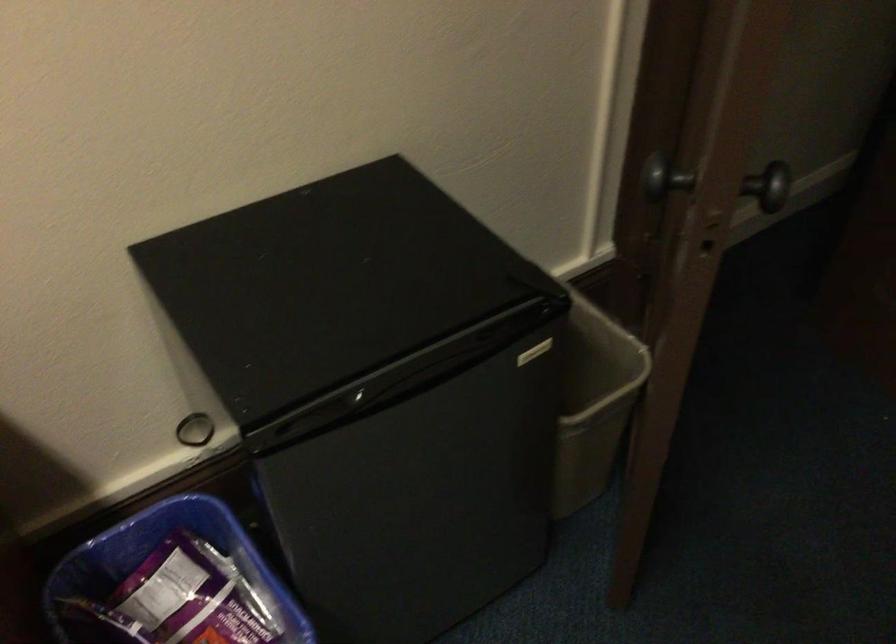
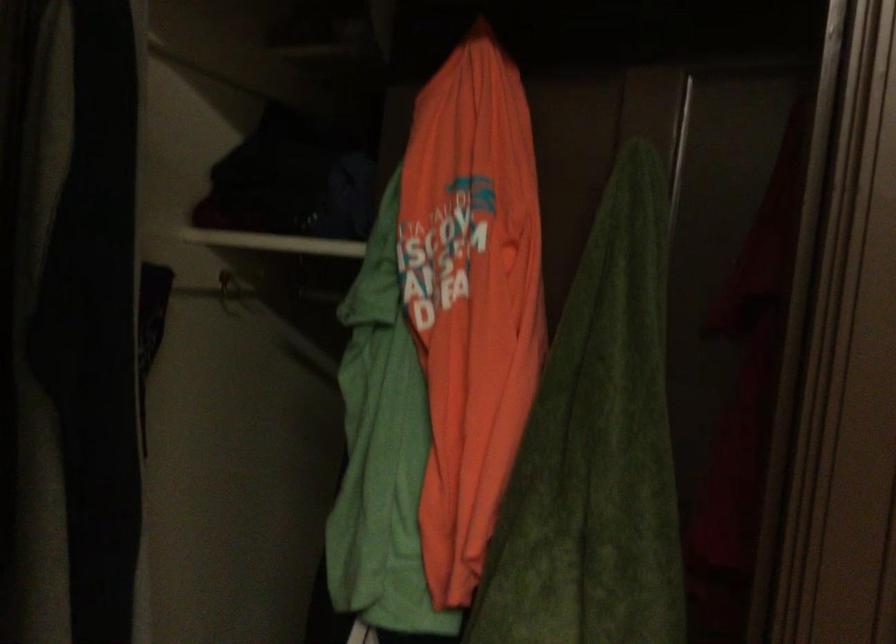
How did the camera likely rotate?

The rotation direction of the camera is right-up.